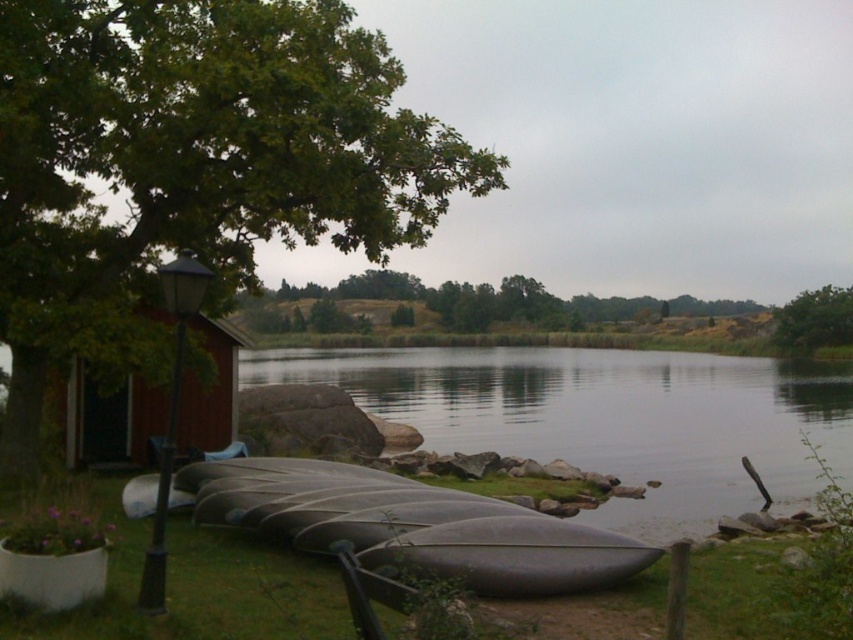
Can you confirm if transparent water at center is positioned to the left of green leafy tree at upper right?

Indeed, transparent water at center is positioned on the left side of green leafy tree at upper right.

Can you confirm if transparent water at center is taller than green leafy tree at upper right?

In fact, transparent water at center may be shorter than green leafy tree at upper right.

Does point (672, 387) come farther from viewer compared to point (795, 317)?

No, (672, 387) is in front of (795, 317).

Where is `transparent water at center`? This screenshot has width=853, height=640. transparent water at center is located at coordinates (608, 419).

From the picture: Who is shorter, transparent water at center or matte black canoe at lower center?

With less height is matte black canoe at lower center.

Which is above, transparent water at center or matte black canoe at lower center?

matte black canoe at lower center

Is point (573, 362) positioned in front of point (360, 467)?

No, it is behind (360, 467).

Locate an element on the screen. transparent water at center is located at coordinates (608, 419).

The height and width of the screenshot is (640, 853). Describe the element at coordinates (608, 419) in the screenshot. I see `transparent water at center` at that location.

Between point (637, 476) and point (194, 410), which one is positioned in front?

Positioned in front is point (194, 410).

Image resolution: width=853 pixels, height=640 pixels. What are the coordinates of `transparent water at center` in the screenshot? It's located at (608, 419).